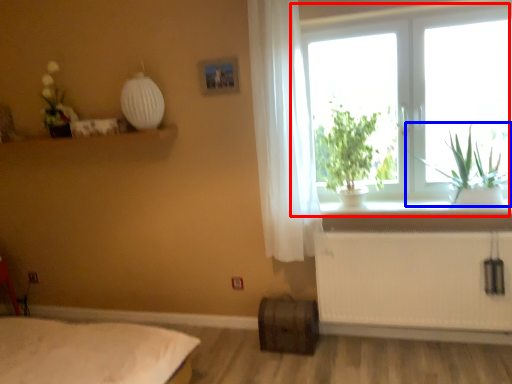
Question: Which of the following is the closest to the observer, window (highlighted by a red box) or plant (highlighted by a blue box)?

Choices:
 (A) window
 (B) plant

Answer: (B)